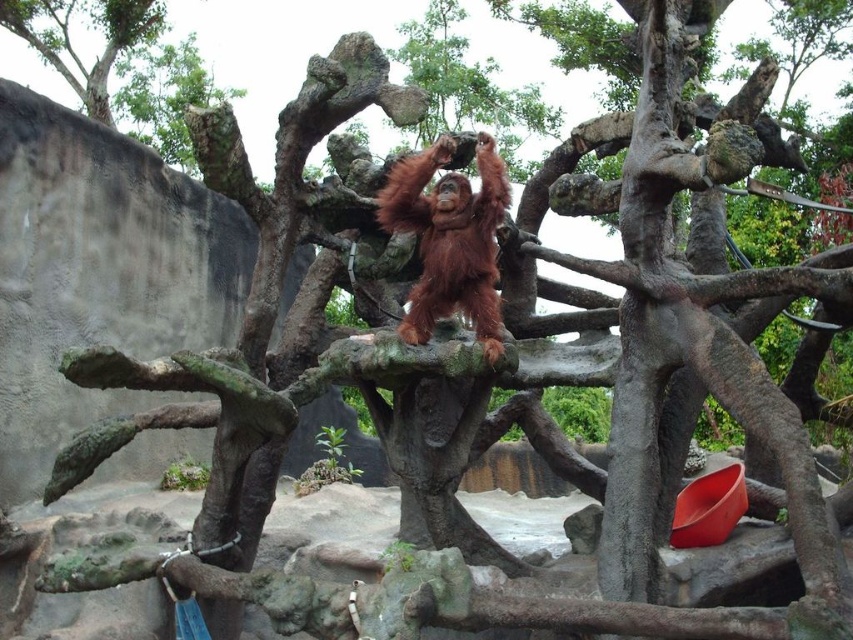
Can you confirm if smooth gray tree trunk at right is bigger than orange fur orangutan at center?

Yes.

Consider the image. Can you confirm if smooth gray tree trunk at right is positioned below orange fur orangutan at center?

No, smooth gray tree trunk at right is not below orange fur orangutan at center.

At what (x,y) coordinates should I click in order to perform the action: click on smooth gray tree trunk at right. Please return your answer as a coordinate pair (x, y). The height and width of the screenshot is (640, 853). Looking at the image, I should click on (645, 305).

Identify the location of smooth gray tree trunk at right. The width and height of the screenshot is (853, 640). (645, 305).

Is smooth gray tree trunk at right bigger than rough bark tree at upper left?

Actually, smooth gray tree trunk at right might be smaller than rough bark tree at upper left.

Between smooth gray tree trunk at right and rough bark tree at upper left, which one appears on the right side from the viewer's perspective?

smooth gray tree trunk at right

Measure the distance between smooth gray tree trunk at right and camera.

The distance of smooth gray tree trunk at right from camera is 9.70 feet.

The height and width of the screenshot is (640, 853). Identify the location of smooth gray tree trunk at right. (645, 305).

Which of these two, orange fur orangutan at center or rough bark tree at upper left, stands taller?

Standing taller between the two is rough bark tree at upper left.

Which is below, orange fur orangutan at center or rough bark tree at upper left?

orange fur orangutan at center

The image size is (853, 640). Find the location of `orange fur orangutan at center`. orange fur orangutan at center is located at coordinates (450, 237).

This screenshot has width=853, height=640. What are the coordinates of `orange fur orangutan at center` in the screenshot? It's located at (450, 237).